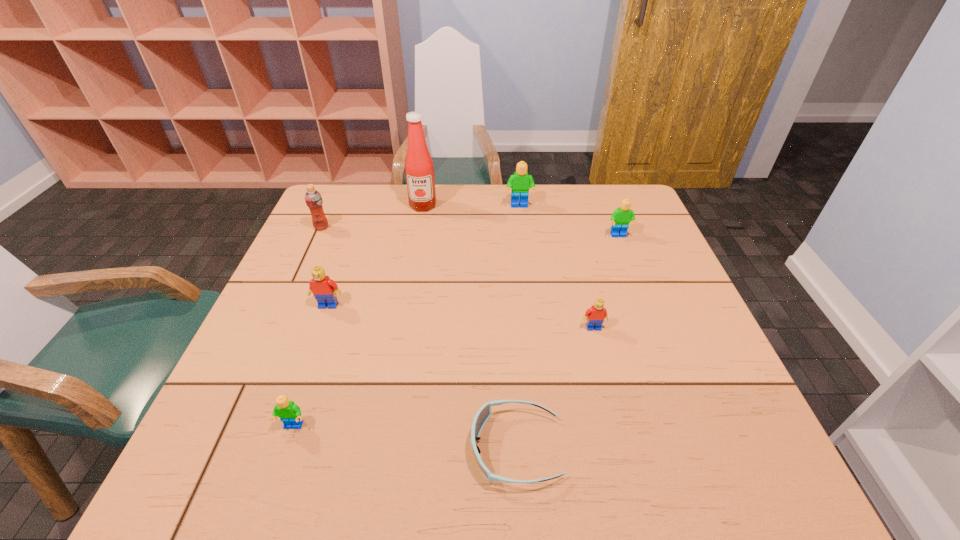
Image resolution: width=960 pixels, height=540 pixels. I want to click on the seventh object from left to right, so click(x=595, y=315).

Locate an element on the screen. the sixth farthest object is located at coordinates (595, 315).

Find the location of `the smallest green Lego`. the smallest green Lego is located at coordinates (290, 414).

Where is `the nearest Lego`? the nearest Lego is located at coordinates (290, 414).

This screenshot has height=540, width=960. I want to click on goggles, so click(483, 414).

Identify the location of free space located 0.370m on the front-facing side of the tallest object. The width and height of the screenshot is (960, 540). (407, 296).

Locate an element on the screen. vacant space located 0.320m on the face of the third Lego from left to right is located at coordinates (528, 279).

Find the location of a particular element. free spot located on the front of the sixth nearest object is located at coordinates (304, 265).

Locate an element on the screen. The image size is (960, 540). vacant region located on the face of the bigger red Lego is located at coordinates (272, 464).

Locate an element on the screen. The height and width of the screenshot is (540, 960). free space located 0.050m on the face of the second nearest green Lego is located at coordinates (624, 251).